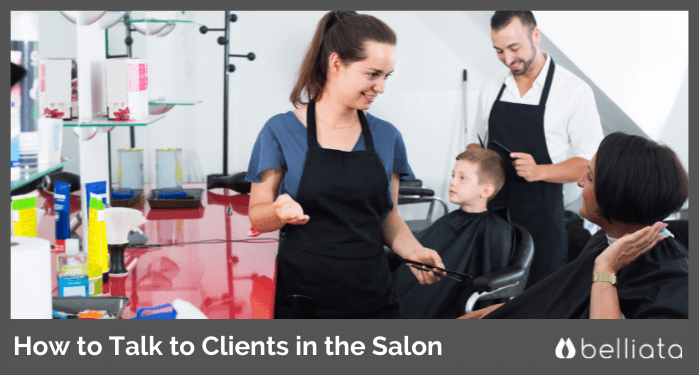
This screenshot has height=375, width=699. Find the location of `chair`. chair is located at coordinates (525, 268), (425, 194).